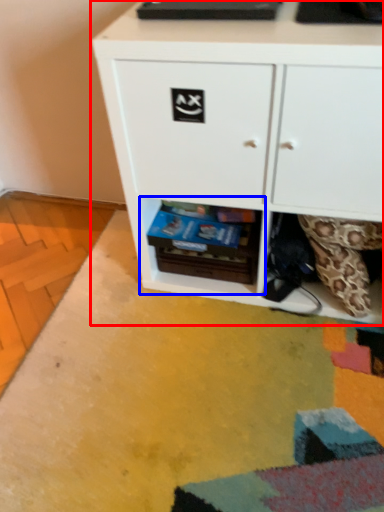
Question: Which of the following is the farthest to the observer, chest of drawers (highlighted by a red box) or shelf (highlighted by a blue box)?

Choices:
 (A) chest of drawers
 (B) shelf

Answer: (B)